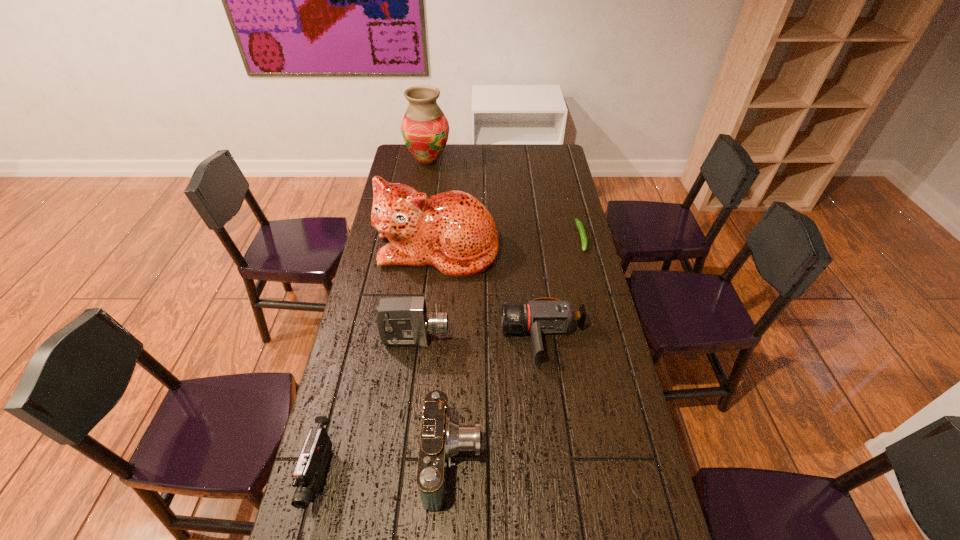
Image resolution: width=960 pixels, height=540 pixels. What are the coordinates of `vacant space that's between the rightmost object and the cat` in the screenshot? It's located at (510, 243).

Find the location of a particular element. The height and width of the screenshot is (540, 960). blank region between the shortest object and the cat is located at coordinates (510, 243).

The width and height of the screenshot is (960, 540). I want to click on the second closest object to the cat, so click(x=402, y=321).

Locate an element on the screen. The image size is (960, 540). object that is the second closest to the fifth tallest object is located at coordinates (402, 321).

Identify which camcorder is the second nearest to the rightmost camcorder. Please provide its 2D coordinates. Your answer should be formatted as a tuple, i.e. [(x, y)], where the tuple contains the x and y coordinates of a point satisfying the conditions above.

[(402, 321)]

Locate an element on the screen. This screenshot has height=540, width=960. camcorder that is the second closest to the cat is located at coordinates (402, 321).

This screenshot has width=960, height=540. Identify the location of free space in the image that satisfies the following two spatial constraints: 1. at the front of the tallest camcorder, highlighting the lens; 2. on the front-facing side of the fifth tallest object. (398, 475).

Identify the location of blank space that satisfies the following two spatial constraints: 1. on the front-facing side of the shortest object; 2. at the front of the fifth shortest object, highlighting the lens. (608, 339).